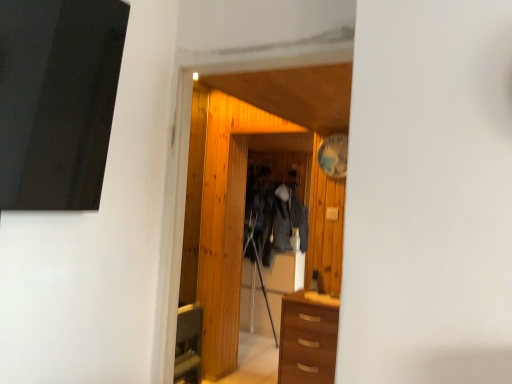
This screenshot has width=512, height=384. Identify the location of wooden door at center. (194, 194).

What is the approximate width of wooden door at center?

5.15 inches.

Image resolution: width=512 pixels, height=384 pixels. Describe the element at coordinates (194, 194) in the screenshot. I see `wooden door at center` at that location.

I want to click on wooden door at center, so click(194, 194).